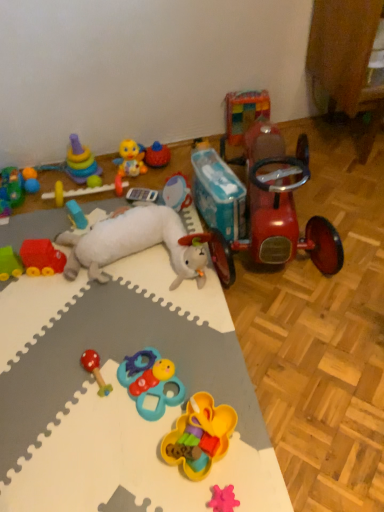
Question: Is multicolored plastic rings at upper left, the 12th toy from the right, in front of or behind pink rubber bear at lower center, which is the 11th toy in left-to-right order, in the image?

Choices:
 (A) front
 (B) behind

Answer: (B)

Question: Is point (39, 169) closer or farther from the camera than point (231, 497)?

Choices:
 (A) closer
 (B) farther

Answer: (B)

Question: Which of these objects is positioned farthest from the rubber car at left, which is the thirteenth toy in right-to-left order?

Choices:
 (A) rubberized yellow flower-shaped toy at center, the 4th toy from the right
 (B) yellow rubber duck at upper center, which is counted as the eighth toy, starting from the right
 (C) wooden/matte rattle at lower left, marked as the 9th toy in a right-to-left arrangement
 (D) matte blue car at center-left, the 11th toy positioned from the right
 (E) translucent plastic toy at upper right, which is counted as the 2th toy, starting from the right

Answer: (A)

Question: Considering the real-world distances, which object is farthest from the matte blue car at center-left, the 11th toy positioned from the right?

Choices:
 (A) yellow rubber duck at upper center, which is counted as the eighth toy, starting from the right
 (B) blue rubber rattle at center, marked as the 8th toy in a left-to-right arrangement
 (C) rubber car at left, placed as the 1th toy when sorted from left to right
 (D) white plush toy at center, the seventh toy when ordered from left to right
 (E) multicolored plastic rings at upper left, marked as the 2th toy in a left-to-right arrangement

Answer: (B)